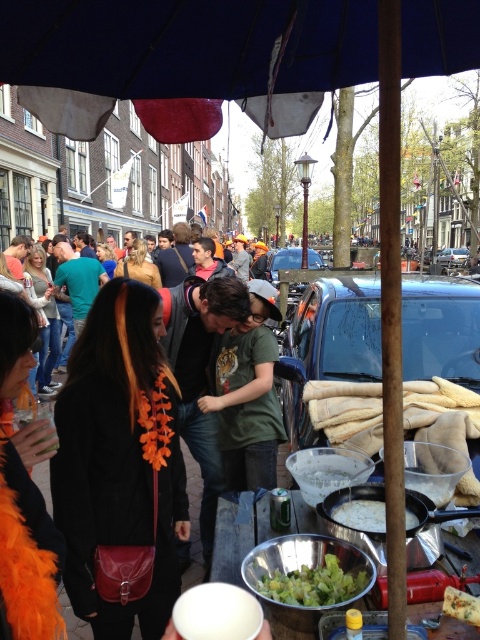
You are at a street festival and need to pack your groceries. You have a green fabric bag at center and a green leafy salad at lower center. Which item can hold more items inside?

The green fabric bag at center has a larger size compared to the green leafy salad at lower center, so it can hold more items inside.

Please describe the exact position of the green fabric bag at center in the image using coordinates. The scene has a table under a blue umbrella with various items including a red fire extinguisher and a green can. The bag is part of the items on the table.

The green fabric bag at center is located at coordinates approximately 0.583 on the x axis and 0.419 on the y axis.